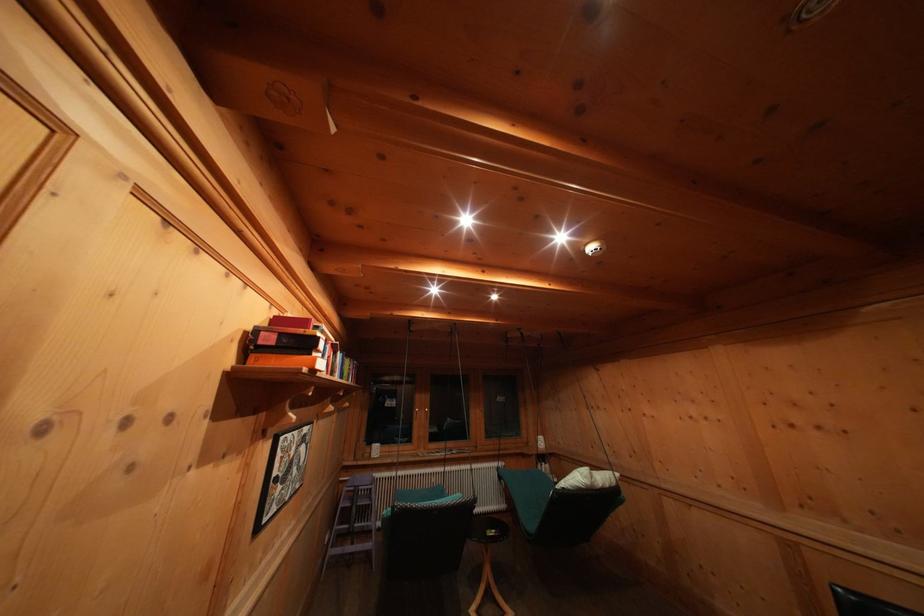
Find the location of a particular element. Image resolution: width=924 pixels, height=616 pixels. black book is located at coordinates (285, 339).